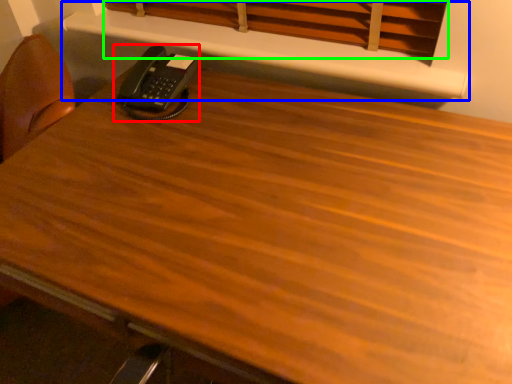
Question: Estimate the real-world distances between objects in this image. Which object is farther from corded phone (highlighted by a red box), shelf (highlighted by a blue box) or curtain (highlighted by a green box)?

Choices:
 (A) shelf
 (B) curtain

Answer: (B)